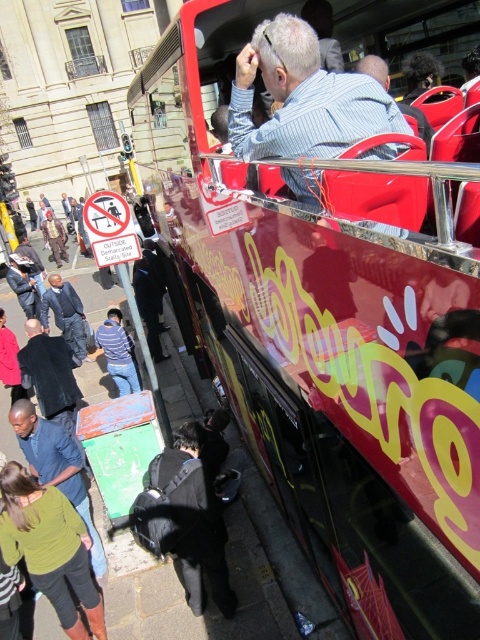
Question: Among these objects, which one is nearest to the camera?

Choices:
 (A) black matte jacket at lower left
 (B) dark blue jeans at lower left

Answer: (A)

Question: Is blue denim shirt at lower left to the left of striped fabric shirt at lower center from the viewer's perspective?

Choices:
 (A) no
 (B) yes

Answer: (A)

Question: Where is black leather backpack at lower center located in relation to blue denim shirt at lower left in the image?

Choices:
 (A) above
 (B) below

Answer: (B)

Question: Can you confirm if blue denim shirt at lower left is smaller than dark blue jeans at lower left?

Choices:
 (A) no
 (B) yes

Answer: (B)

Question: Which object is the farthest from the dark blue jeans at lower left?

Choices:
 (A) black matte jacket at lower left
 (B) blue striped shirt at upper center
 (C) blue denim shirt at lower left

Answer: (B)

Question: Which object is the farthest from the dark blue jeans at lower left?

Choices:
 (A) striped fabric shirt at lower center
 (B) shiny red bus at upper right

Answer: (B)